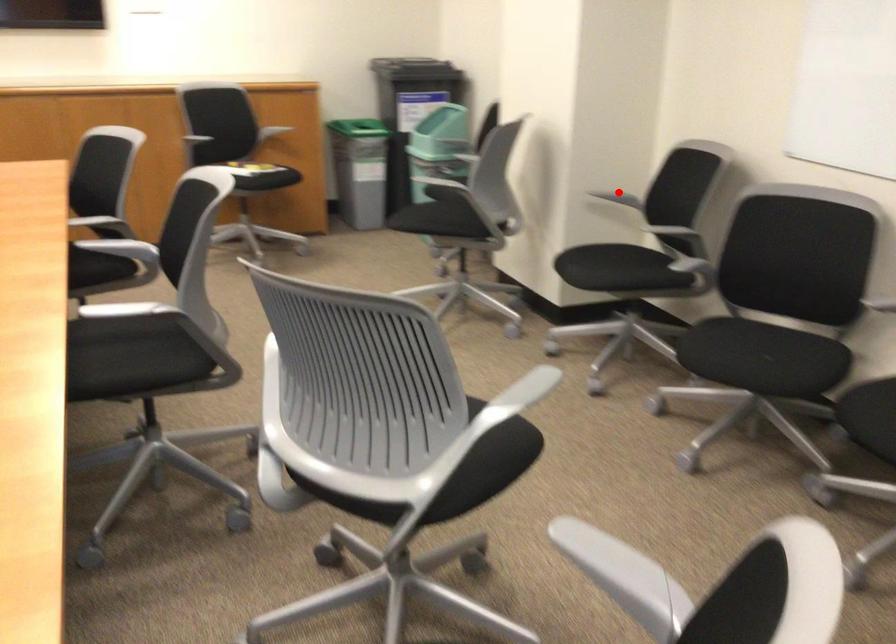
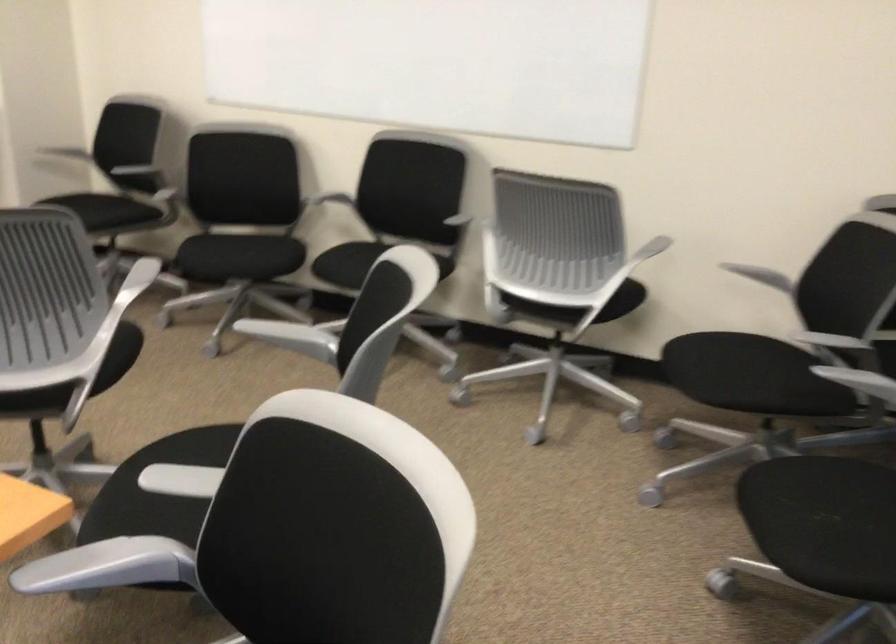
Question: A red point is marked in image1. In image2, is the corresponding 3D point closer to the camera or farther? Reply with the corresponding letter.

Choices:
 (A) The corresponding 3D point is closer.
 (B) The corresponding 3D point is farther.

Answer: (B)